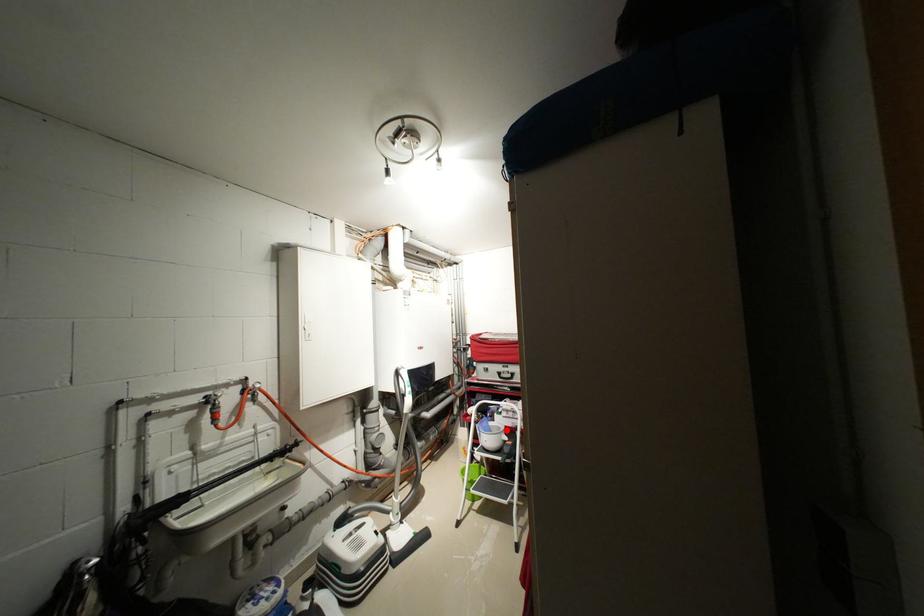
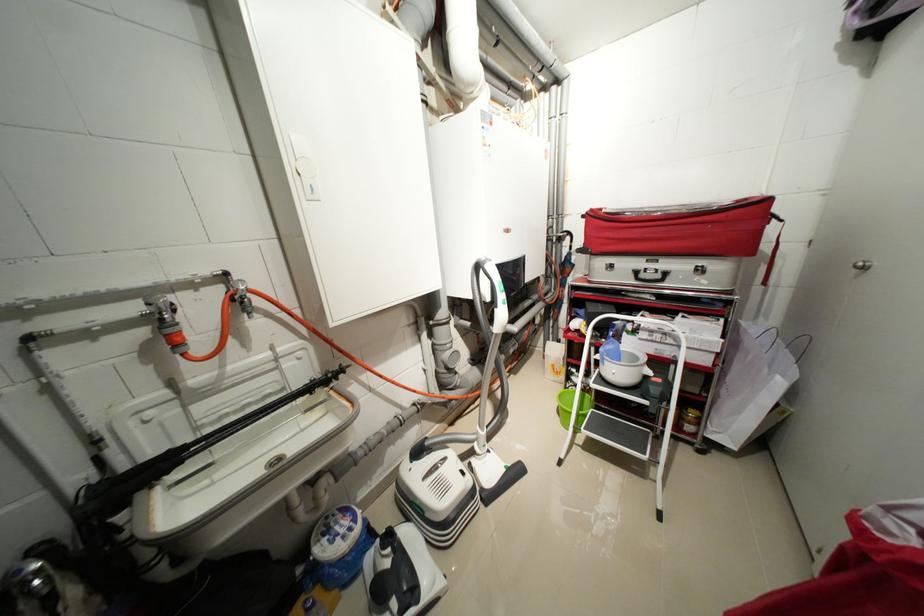
In the second image, find the point that corresponds to the highlighted location in the first image.

(642, 359)